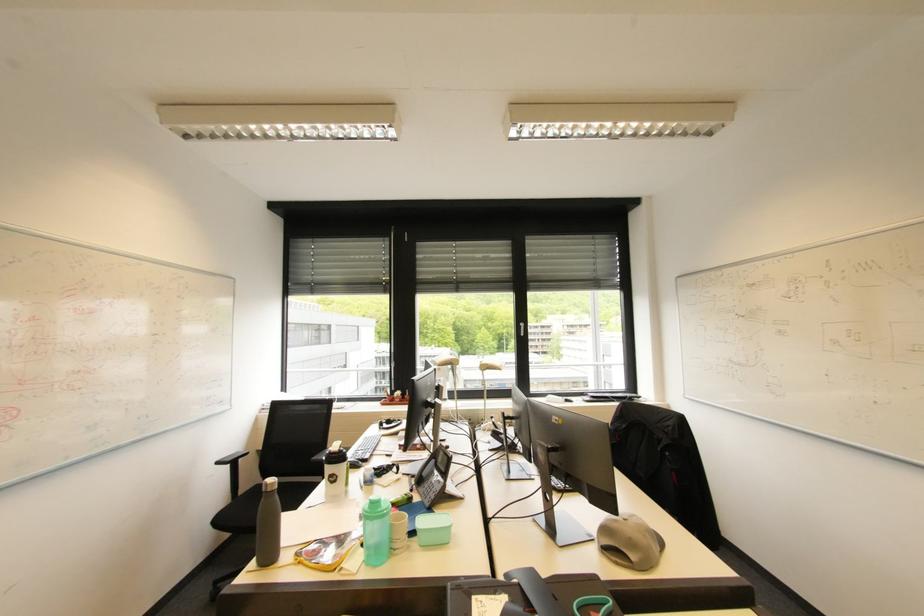
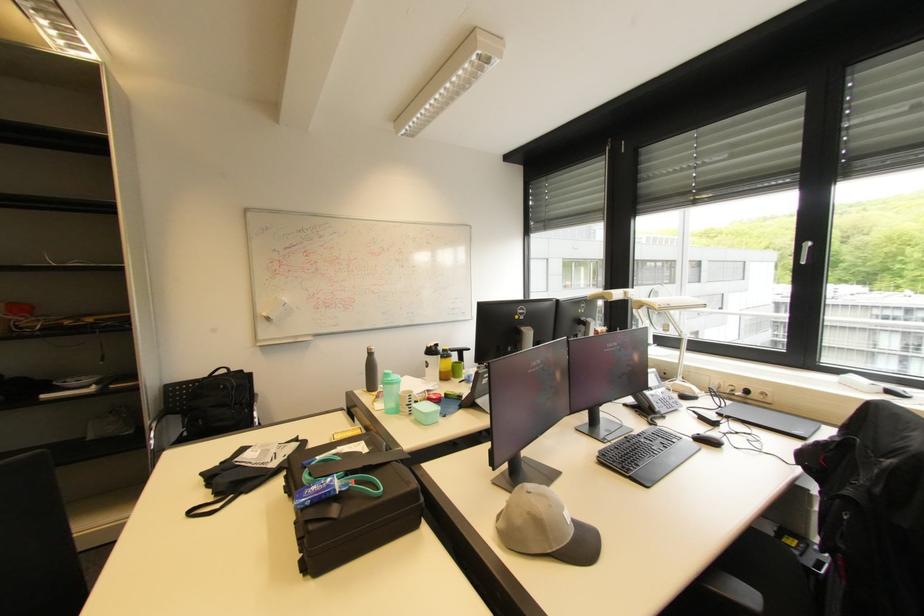
The point at (386, 507) is marked in the first image. Where is the corresponding point in the second image?

(394, 379)